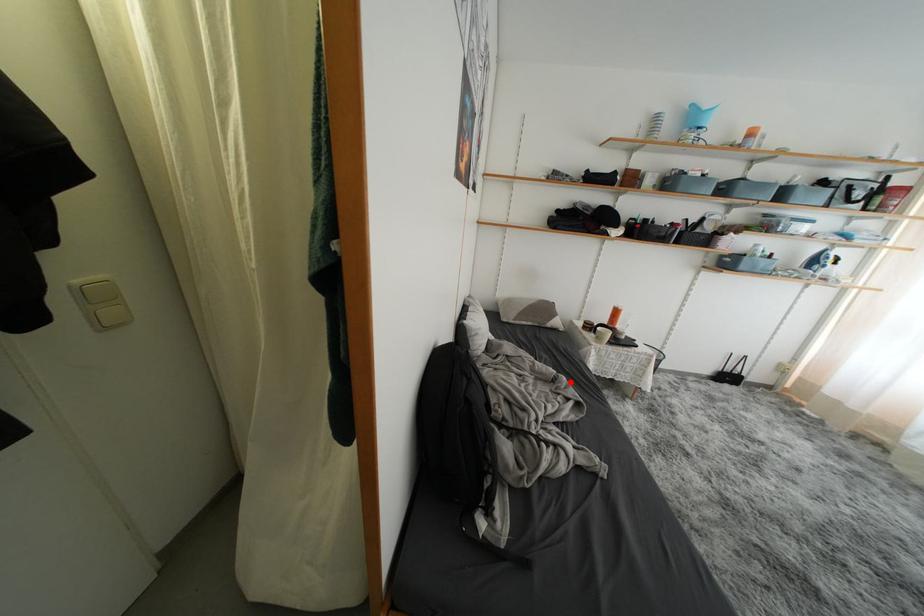
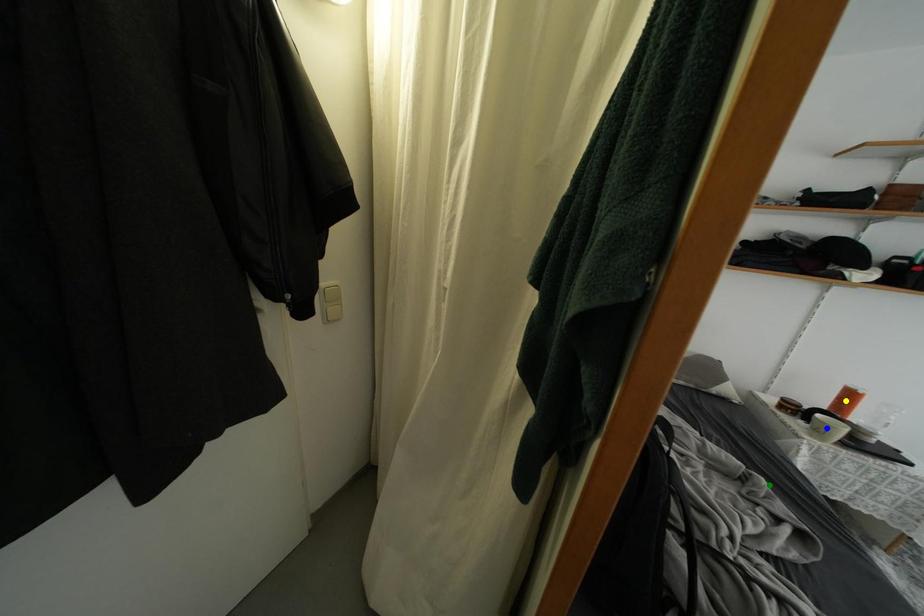
Question: I am providing you with two images of the same scene from different viewpoints. A red point is marked on the first image. You are given multiple points on the second image. Which point in image 2 is actually the same real-world point as the red point in image 1?

Choices:
 (A) yellow point
 (B) green point
 (C) blue point

Answer: (B)